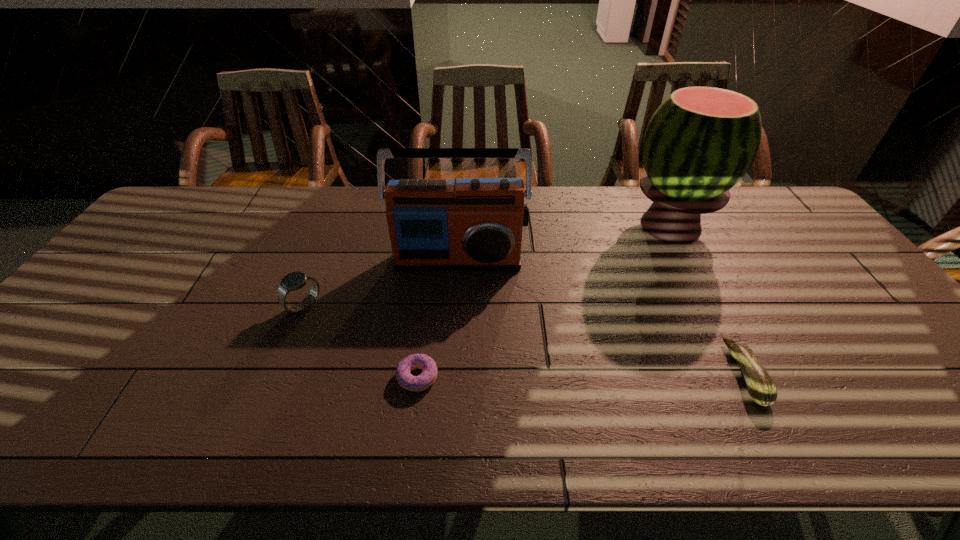
The height and width of the screenshot is (540, 960). In order to click on free space located at the stem end of the second shortest object in this screenshot , I will do `click(707, 374)`.

Where is `free spot located 0.140m at the stem end of the second shortest object`? The image size is (960, 540). free spot located 0.140m at the stem end of the second shortest object is located at coordinates (672, 374).

You are a GUI agent. You are given a task and a screenshot of the screen. Output one action in this format:
    pyautogui.click(x=<x>, y=<y>)
    Task: Click on the vacant region located 0.070m on the left of the doughnut
    Image resolution: width=960 pixels, height=540 pixels.
    Given the screenshot: What is the action you would take?
    pyautogui.click(x=366, y=377)

At what (x,y) coordinates should I click in order to perform the action: click on object located in the far edge section of the desktop. Please return your answer as a coordinate pair (x, y). The image size is (960, 540). Looking at the image, I should click on (699, 143).

At what (x,y) coordinates should I click in order to perform the action: click on object at the near edge. Please return your answer as a coordinate pair (x, y). This screenshot has height=540, width=960. Looking at the image, I should click on (761, 388).

In the image, there is a desktop. At what (x,y) coordinates should I click in order to perform the action: click on free space at the far edge. Please return your answer as a coordinate pair (x, y). Image resolution: width=960 pixels, height=540 pixels. Looking at the image, I should click on (233, 187).

Locate an element on the screen. free space at the near edge is located at coordinates (596, 447).

In the image, there is a desktop. In order to click on vacant space at the right edge in this screenshot , I will do `click(866, 294)`.

This screenshot has height=540, width=960. I want to click on vacant position at the near left corner of the desktop, so click(11, 421).

At what (x,y) coordinates should I click in order to perform the action: click on blank area at the far right corner. Please return your answer as a coordinate pair (x, y). Looking at the image, I should click on (780, 200).